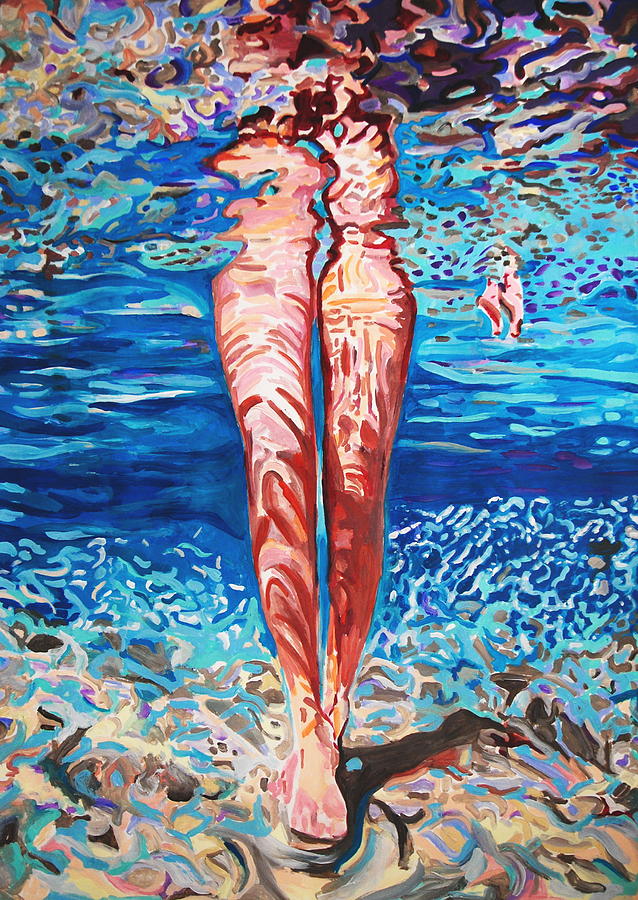
Where is `abstract painting`? abstract painting is located at coordinates (29, 893).